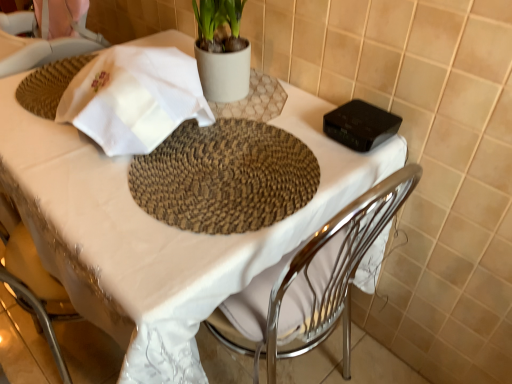
I want to click on white embroidered cloth at upper left, so click(134, 98).

The width and height of the screenshot is (512, 384). Describe the element at coordinates (134, 98) in the screenshot. I see `white embroidered cloth at upper left` at that location.

What is the approximate height of white embroidered cloth at upper left?

white embroidered cloth at upper left is 0.52 inches in height.

Find the location of a particular element. This screenshot has width=512, height=384. white fabric table at center is located at coordinates (157, 229).

What do you see at coordinates (157, 229) in the screenshot? This screenshot has width=512, height=384. I see `white fabric table at center` at bounding box center [157, 229].

At what (x,y) coordinates should I click in order to perform the action: click on white embroidered cloth at upper left. Please return your answer as a coordinate pair (x, y). Looking at the image, I should click on (134, 98).

Can you confirm if white fabric table at center is positioned to the left of white embroidered cloth at upper left?

Incorrect, white fabric table at center is not on the left side of white embroidered cloth at upper left.

Looking at this image, is white fabric table at center positioned behind white embroidered cloth at upper left?

No, it is not.

Is point (181, 313) positioned before point (179, 103)?

Yes, point (181, 313) is in front of point (179, 103).

From the image's perspective, who appears lower, white fabric table at center or white embroidered cloth at upper left?

From the image's view, white fabric table at center is below.

From a real-world perspective, is white fabric table at center physically below white embroidered cloth at upper left?

Indeed, from a real-world perspective, white fabric table at center is positioned beneath white embroidered cloth at upper left.

Considering the relative sizes of white fabric table at center and white embroidered cloth at upper left in the image provided, is white fabric table at center thinner than white embroidered cloth at upper left?

Incorrect, the width of white fabric table at center is not less than that of white embroidered cloth at upper left.

Which of these two, white fabric table at center or white embroidered cloth at upper left, stands taller?

white fabric table at center.

Considering the sizes of objects white fabric table at center and white embroidered cloth at upper left in the image provided, who is bigger, white fabric table at center or white embroidered cloth at upper left?

white fabric table at center is bigger.

Can white embroidered cloth at upper left be found inside white fabric table at center?

No, white embroidered cloth at upper left is not surrounded by white fabric table at center.

Is white fabric table at center positioned far away from white embroidered cloth at upper left?

white fabric table at center is near white embroidered cloth at upper left, not far away.

Is white fabric table at center aimed at white embroidered cloth at upper left?

No, white fabric table at center is not turned towards white embroidered cloth at upper left.

What's the angular difference between white fabric table at center and white embroidered cloth at upper left's facing directions?

They differ by 1.1 degrees in their facing directions.

Find the location of a particular element. This screenshot has height=384, width=512. table directly beneath the white embroidered cloth at upper left (from a real-world perspective) is located at coordinates (157, 229).

Is white embroidered cloth at upper left to the left or to the right of white fabric table at center in the image?

Clearly, white embroidered cloth at upper left is on the left of white fabric table at center in the image.

Which object is closer to the camera, white embroidered cloth at upper left or white fabric table at center?

Positioned in front is white fabric table at center.

Which point is more distant from viewer, (140, 121) or (153, 293)?

The point (140, 121) is more distant.

From the image's perspective, is white embroidered cloth at upper left above or below white fabric table at center?

From the image's perspective, white embroidered cloth at upper left appears above white fabric table at center.

From a real-world perspective, is white embroidered cloth at upper left under white fabric table at center?

No, from a real-world perspective, white embroidered cloth at upper left is not beneath white fabric table at center.

Considering the relative sizes of white embroidered cloth at upper left and white fabric table at center in the image provided, is white embroidered cloth at upper left thinner than white fabric table at center?

Correct, the width of white embroidered cloth at upper left is less than that of white fabric table at center.

Considering the relative sizes of white embroidered cloth at upper left and white fabric table at center in the image provided, is white embroidered cloth at upper left shorter than white fabric table at center?

Correct, white embroidered cloth at upper left is not as tall as white fabric table at center.

Looking at the image, does white embroidered cloth at upper left seem bigger or smaller compared to white fabric table at center?

In the image, white embroidered cloth at upper left appears to be smaller than white fabric table at center.

Is white embroidered cloth at upper left positioned beyond the bounds of white fabric table at center?

That's correct, white embroidered cloth at upper left is outside of white fabric table at center.

Is white embroidered cloth at upper left not near white fabric table at center?

No.

Is white embroidered cloth at upper left facing towards white fabric table at center?

No, white embroidered cloth at upper left is not turned towards white fabric table at center.

Identify the location of cloth located on the left of white fabric table at center. (134, 98).

In the image, there is a white fabric table at center. Where is `cloth above it (from the image's perspective)`? The image size is (512, 384). cloth above it (from the image's perspective) is located at coordinates (134, 98).

Identify the location of cloth on the left side of white fabric table at center. (134, 98).